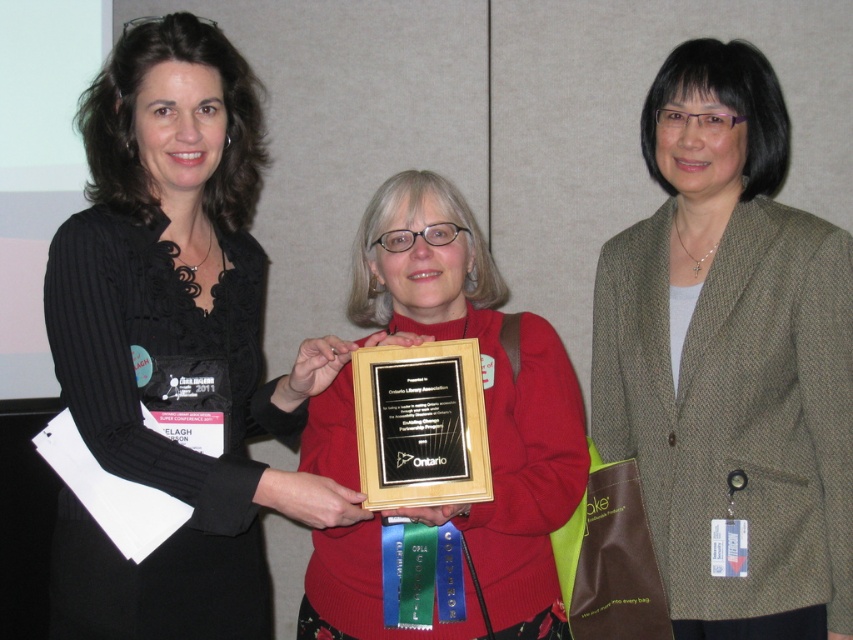
Question: Can you confirm if black ribbed sweater at upper left is smaller than matte wood plaque at center?

Choices:
 (A) no
 (B) yes

Answer: (A)

Question: Observing the image, what is the correct spatial positioning of black ribbed sweater at upper left in reference to wooden plaque at center?

Choices:
 (A) left
 (B) right

Answer: (A)

Question: Which point is closer to the camera?

Choices:
 (A) (779, 477)
 (B) (373, 214)
 (C) (149, 396)

Answer: (C)

Question: Is green tweed blazer at center further to camera compared to wooden plaque at center?

Choices:
 (A) yes
 (B) no

Answer: (A)

Question: Which object appears closest to the camera in this image?

Choices:
 (A) black ribbed sweater at upper left
 (B) green tweed blazer at center

Answer: (A)

Question: Among these points, which one is nearest to the camera?

Choices:
 (A) (804, 440)
 (B) (363, 266)
 (C) (457, 424)
 (D) (234, 202)

Answer: (C)